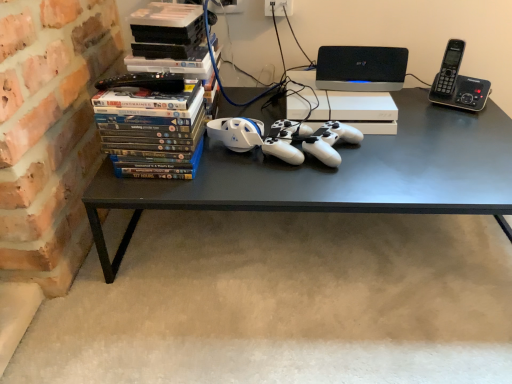
The height and width of the screenshot is (384, 512). I want to click on free space to the left of black plastic speaker at upper center, so click(x=308, y=87).